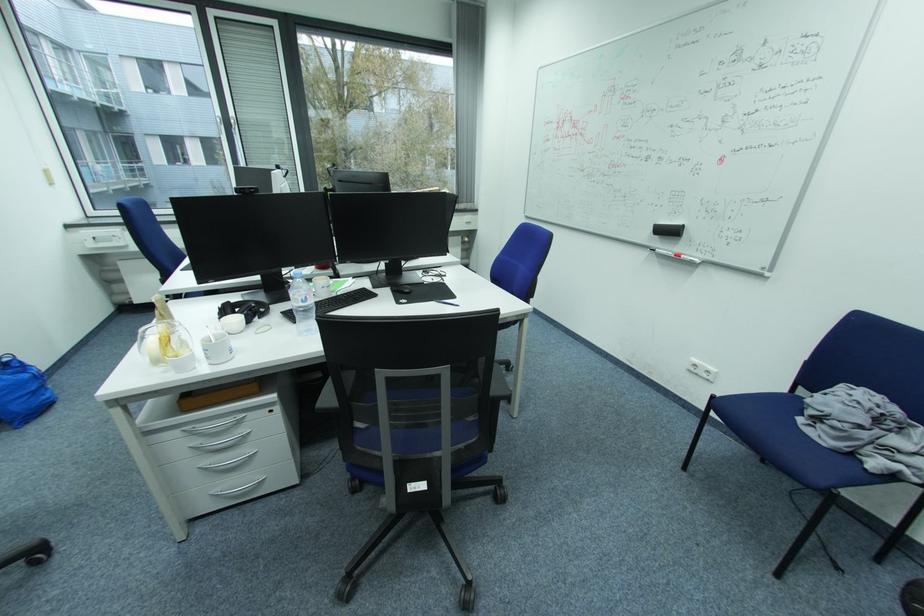
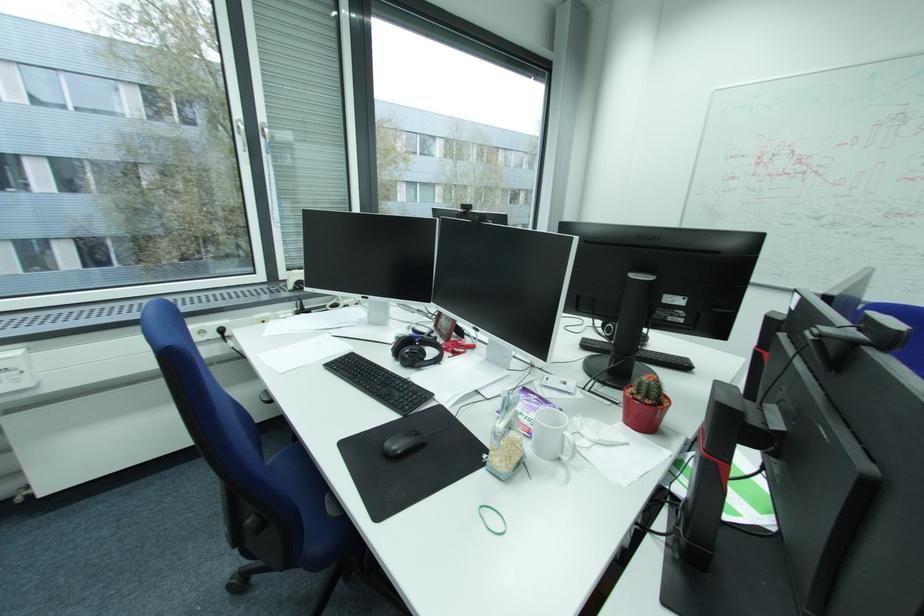
In the second image, find the point that corresponds to point (381, 184) in the first image.

(725, 253)